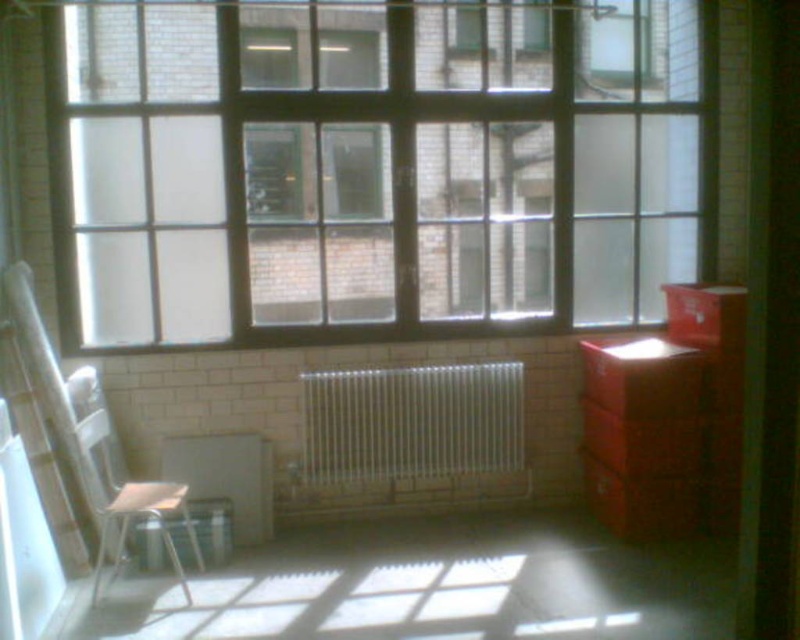
Based on the photo, you are standing in the room and want to move the metallic silver stool at lower left closer to the white metallic radiator at center. Can you move it directly in front of the radiator without moving the radiator itself?

The metallic silver stool at lower left is currently behind the white metallic radiator at center. Since the radiator is mounted on the wall, you can move the stool directly in front of it by moving it forward towards the wall, as there is space in front of the radiator not occupied by the stool.

You are standing in the room and need to move from the white plastic chair at left to the radiator. Which direction should you move to reach the radiator?

The white plastic chair at left is located at point (x=126, y=484), so you should move towards the right to reach the radiator.

From the picture: You are organizing a small meeting in the room and need to seat two people. There is a white plastic chair at left and a metallic silver stool at lower left. Which seating option provides more space for a person?

The white plastic chair at left has a larger size compared to the metallic silver stool at lower left, so it provides more space for a person.